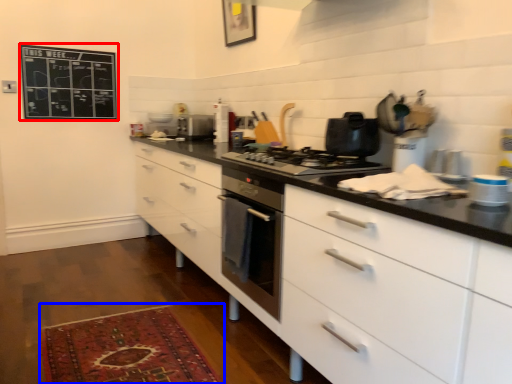
Question: Among these objects, which one is farthest to the camera, bulletin board (highlighted by a red box) or mat (highlighted by a blue box)?

Choices:
 (A) bulletin board
 (B) mat

Answer: (A)